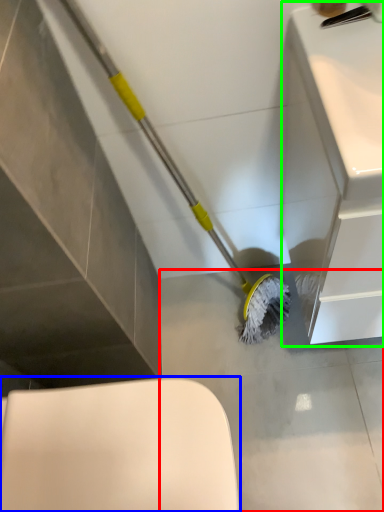
Question: Which is farther away from concrete (highlighted by a red box)? toilet (highlighted by a blue box) or counter top (highlighted by a green box)?

Choices:
 (A) toilet
 (B) counter top

Answer: (A)